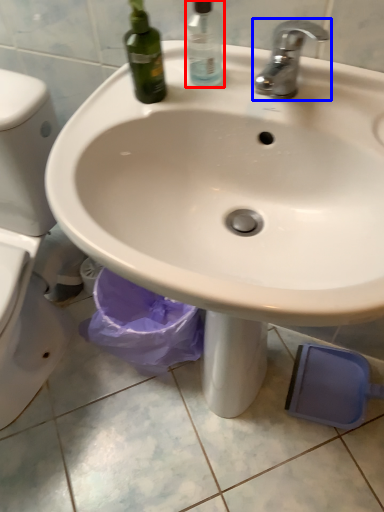
Question: Which of the following is the farthest to the observer, cleaning product (highlighted by a red box) or tap (highlighted by a blue box)?

Choices:
 (A) cleaning product
 (B) tap

Answer: (A)